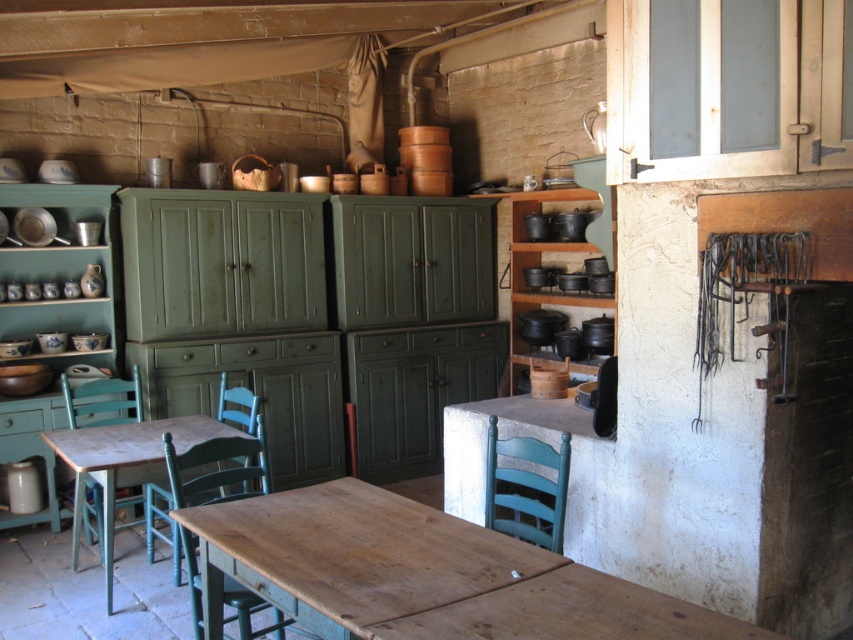
You are a guest in this rustic kitchen and need to sit down. You see the wooden table at lower left and the teal wood chair at lower center. Which object is wider?

The wooden table at lower left is wider than the teal wood chair at lower center because its width surpasses the chair.

You are sitting at the green wood chair at center in a rustic kitchen. You want to move to the teal wood chair at lower center. Which direction should you move to reach it?

The teal wood chair at lower center is above the green wood chair at center, so you should move upward to reach it.